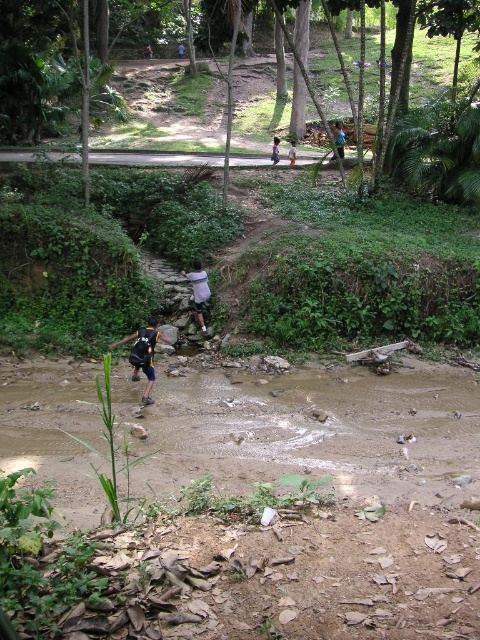
You are standing at the starting point and see the brown muddy stream at lower center and the white matte shirt at center. Which object is closer to you?

The white matte shirt at center is closer to you than the brown muddy stream at lower center because the brown muddy stream at lower center is 7.27 meters away from the white matte shirt at center.

You are a hiker wearing a white matte shirt at center and need to cross the brown muddy stream at lower center. Based on the scene description, can you safely cross the stream without getting your shirt wet?

The brown muddy stream at lower center is narrower than the white matte shirt at center, so it is possible to cross safely without getting the shirt wet.

You are standing at the center of the image and want to cross the brown muddy stream at lower center. Which direction should you move to reach it?

The brown muddy stream at lower center is located at coordinates approximately 0.673 on the x axis and 0.648 on the y axis. Since you are at the center, you need to move slightly to the right and forward to reach it.